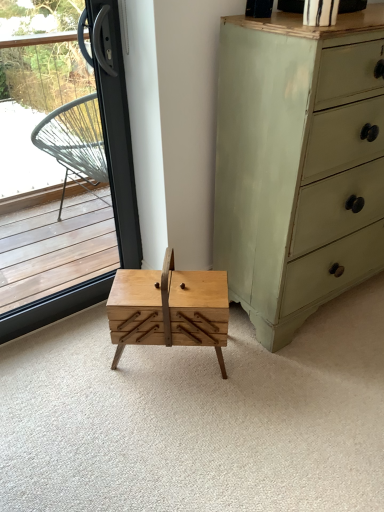
Find the location of a particular element. The width and height of the screenshot is (384, 512). vacant area on top of natural wood drawer at center (from a real-world perspective) is located at coordinates (222, 400).